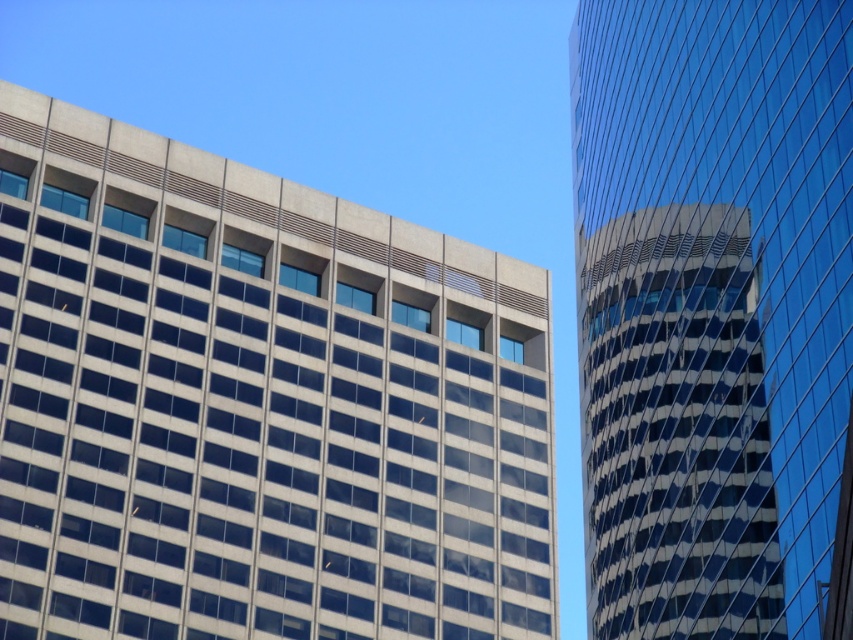
From the picture: You are standing in the middle of the street between the gray concrete building at upper left and the glassy reflective tower at right. Which building would you see first if you look to your left?

The gray concrete building at upper left is to the left of the glassy reflective tower at right, so you would see the gray concrete building at upper left first when looking to your left.

You are an architect analyzing the two buildings in the scene. Based on their positions and the available space, could the glassy reflective tower at right potentially be wider than the gray concrete building at upper left?

The gray concrete building at upper left might be wider than glassy reflective tower at right, so the glassy reflective tower at right is likely not wider than the gray concrete building at upper left.